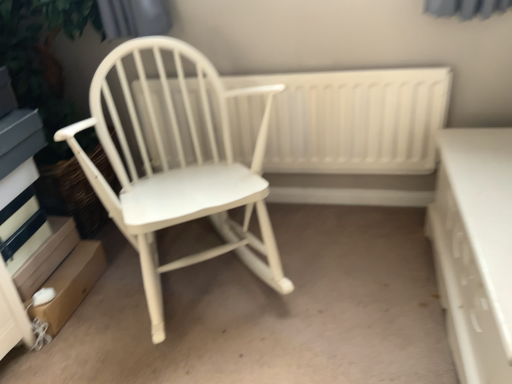
Question: Is white wood radiator at center bigger than white wood rocking chair at left?

Choices:
 (A) no
 (B) yes

Answer: (A)

Question: Can you confirm if white wood radiator at center is wider than white wood rocking chair at left?

Choices:
 (A) yes
 (B) no

Answer: (B)

Question: Is white wood radiator at center to the right of white wood rocking chair at left from the viewer's perspective?

Choices:
 (A) no
 (B) yes

Answer: (B)

Question: Considering the relative sizes of white wood radiator at center and white wood rocking chair at left in the image provided, is white wood radiator at center thinner than white wood rocking chair at left?

Choices:
 (A) yes
 (B) no

Answer: (A)

Question: From a real-world perspective, is white wood radiator at center physically above white wood rocking chair at left?

Choices:
 (A) no
 (B) yes

Answer: (A)

Question: From a real-world perspective, is white wood radiator at center located beneath white wood rocking chair at left?

Choices:
 (A) yes
 (B) no

Answer: (A)

Question: Is white wood rocking chair at left further to camera compared to white glossy drawer at right?

Choices:
 (A) no
 (B) yes

Answer: (B)

Question: Considering the relative positions of white wood rocking chair at left and white glossy drawer at right in the image provided, is white wood rocking chair at left to the left of white glossy drawer at right from the viewer's perspective?

Choices:
 (A) yes
 (B) no

Answer: (A)

Question: Is white wood rocking chair at left smaller than white glossy drawer at right?

Choices:
 (A) no
 (B) yes

Answer: (A)

Question: Does white wood rocking chair at left have a greater width compared to white glossy drawer at right?

Choices:
 (A) yes
 (B) no

Answer: (A)

Question: Is white wood rocking chair at left outside of white glossy drawer at right?

Choices:
 (A) yes
 (B) no

Answer: (A)

Question: From a real-world perspective, is white wood rocking chair at left located beneath white glossy drawer at right?

Choices:
 (A) yes
 (B) no

Answer: (B)

Question: Could white wood radiator at center be considered to be inside white wood rocking chair at left?

Choices:
 (A) yes
 (B) no

Answer: (B)